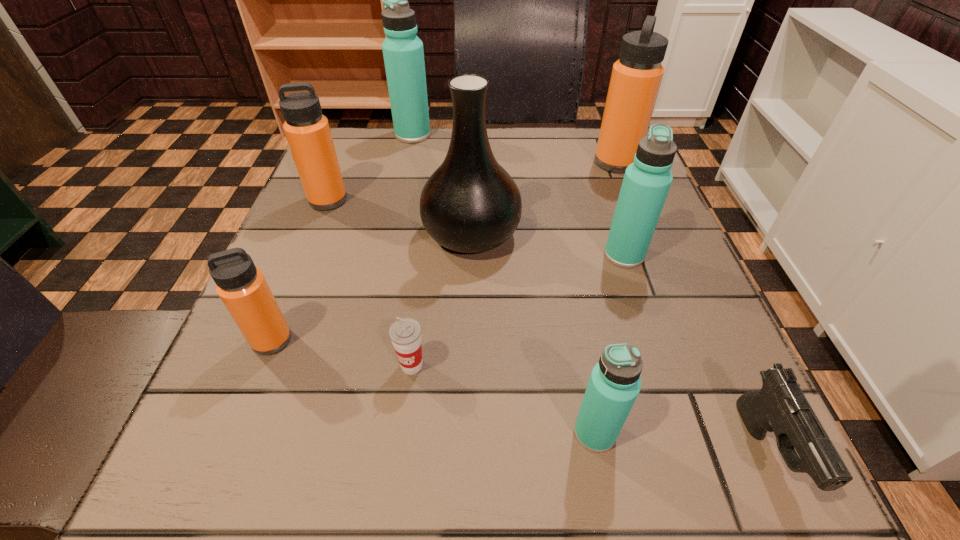
I want to click on vacant space at the near edge of the desktop, so click(x=588, y=498).

Identify the location of free spot at the left edge of the desktop. 312,267.

I want to click on free space at the right edge of the desktop, so click(683, 299).

This screenshot has width=960, height=540. I want to click on vacant space at the far left corner of the desktop, so click(x=346, y=149).

Identify the location of free region at the near left corner. The height and width of the screenshot is (540, 960). (252, 472).

Identify the location of vacant area at the near right corner of the desktop. The image size is (960, 540). [783, 468].

This screenshot has width=960, height=540. In order to click on vacant space that is in between the vase and the nearest orange thermos bottle in this screenshot , I will do [372, 287].

The height and width of the screenshot is (540, 960). I want to click on empty space between the vase and the second farthest aqua thermos bottle, so click(548, 244).

Locate an element on the screen. This screenshot has width=960, height=540. vacant region between the biggest orange thermos bottle and the black pistol is located at coordinates (690, 307).

Identify the location of empty space between the vase and the second nearest orange thermos bottle. (399, 217).